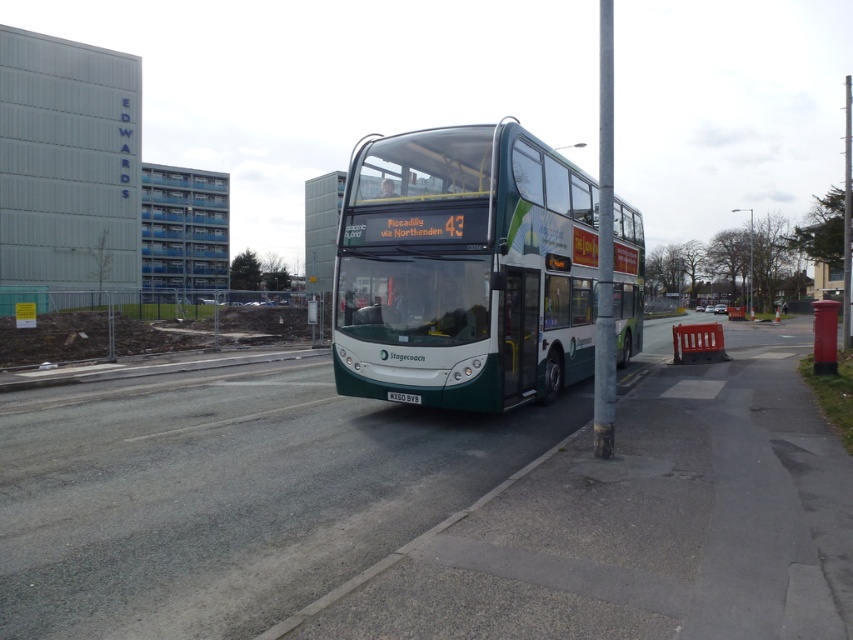
Question: Can you confirm if green matte/deck bus at center is thinner than white plastic license plate at center?

Choices:
 (A) no
 (B) yes

Answer: (A)

Question: Is silver metallic pole at right bigger than white plastic license plate at center?

Choices:
 (A) no
 (B) yes

Answer: (B)

Question: Considering the real-world distances, which object is closest to the silver metallic pole at right?

Choices:
 (A) green matte/deck bus at center
 (B) white plastic license plate at center

Answer: (A)

Question: Which is nearer to the green matte/deck bus at center?

Choices:
 (A) white plastic license plate at center
 (B) silver metallic pole at right

Answer: (A)

Question: Which of the following is the farthest from the observer?

Choices:
 (A) silver metallic pole at right
 (B) green matte/deck bus at center

Answer: (A)

Question: Is green matte/deck bus at center wider than white plastic license plate at center?

Choices:
 (A) no
 (B) yes

Answer: (B)